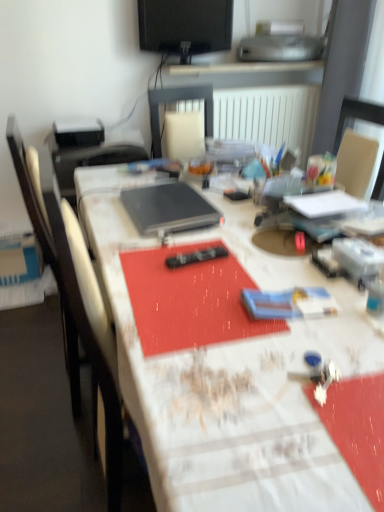
The width and height of the screenshot is (384, 512). What are the coordinates of `vacant space to the right of black plastic remote control at center` in the screenshot? It's located at (259, 259).